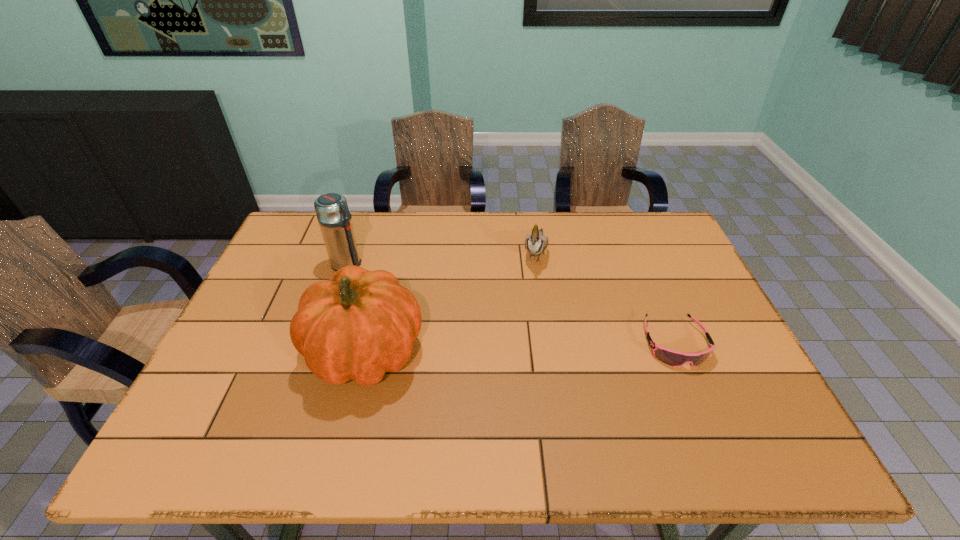
The height and width of the screenshot is (540, 960). I want to click on object that ranks as the second closest to the thermos bottle, so click(x=535, y=243).

Locate an element on the screen. The width and height of the screenshot is (960, 540). vacant space that satisfies the following two spatial constraints: 1. on the back side of the thermos bottle; 2. on the left side of the bird is located at coordinates (352, 252).